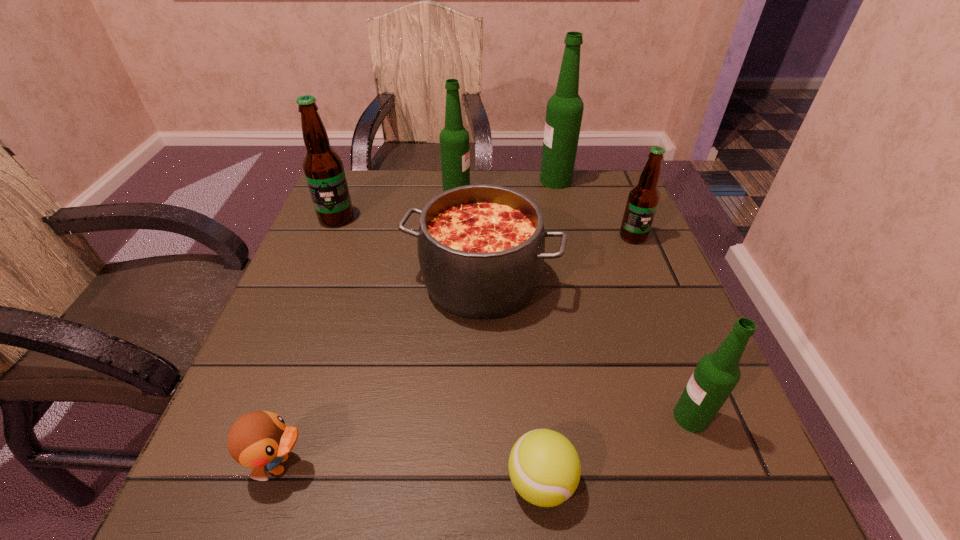
The image size is (960, 540). I want to click on green beer bottle that is the second closest to the green tennis ball, so click(x=454, y=140).

Where is `the closest green beer bottle to the shortest object`? The image size is (960, 540). the closest green beer bottle to the shortest object is located at coordinates (716, 375).

Locate an element on the screen. This screenshot has height=540, width=960. blank space that satisfies the following two spatial constraints: 1. on the label of the second smallest green beer bottle; 2. on the label of the leftmost beer bottle is located at coordinates point(455,218).

Find the location of a particular element. The width and height of the screenshot is (960, 540). vacant position in the image that satisfies the following two spatial constraints: 1. on the label of the right brown beer bottle; 2. on the label of the nearest beer bottle is located at coordinates (708, 417).